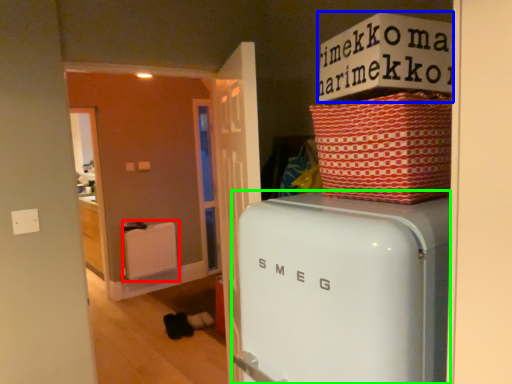
Question: Which object is the closest to the radiator (highlighted by a red box)? Choose among these: cardboard box (highlighted by a blue box) or home appliance (highlighted by a green box).

Choices:
 (A) cardboard box
 (B) home appliance

Answer: (B)